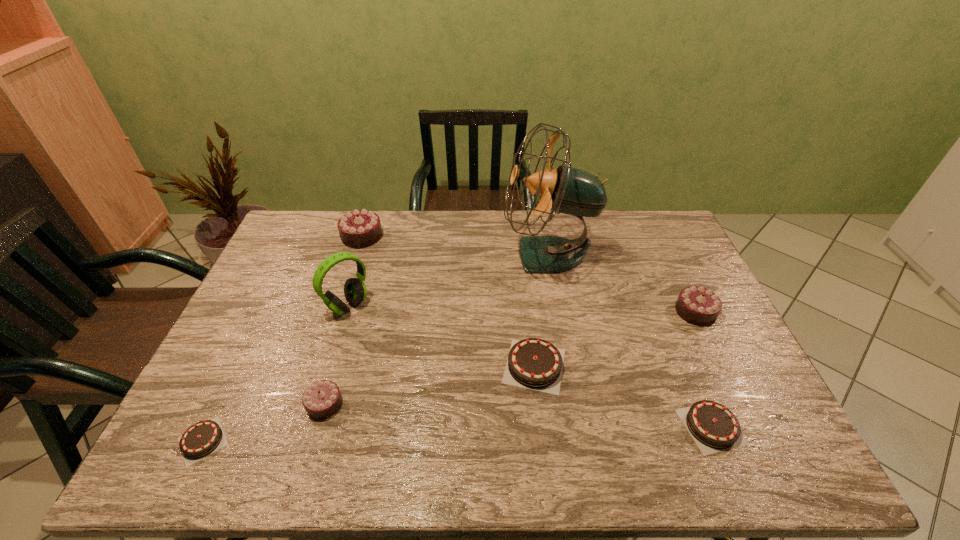
Identify the location of free space that satisfies the following two spatial constraints: 1. on the front-facing side of the second shortest object for air flow; 2. on the right side of the fan. This screenshot has width=960, height=540. (578, 427).

This screenshot has height=540, width=960. I want to click on free space in the image that satisfies the following two spatial constraints: 1. on the front side of the smallest chocolate chocolate cake; 2. on the right side of the second tallest object, so click(319, 404).